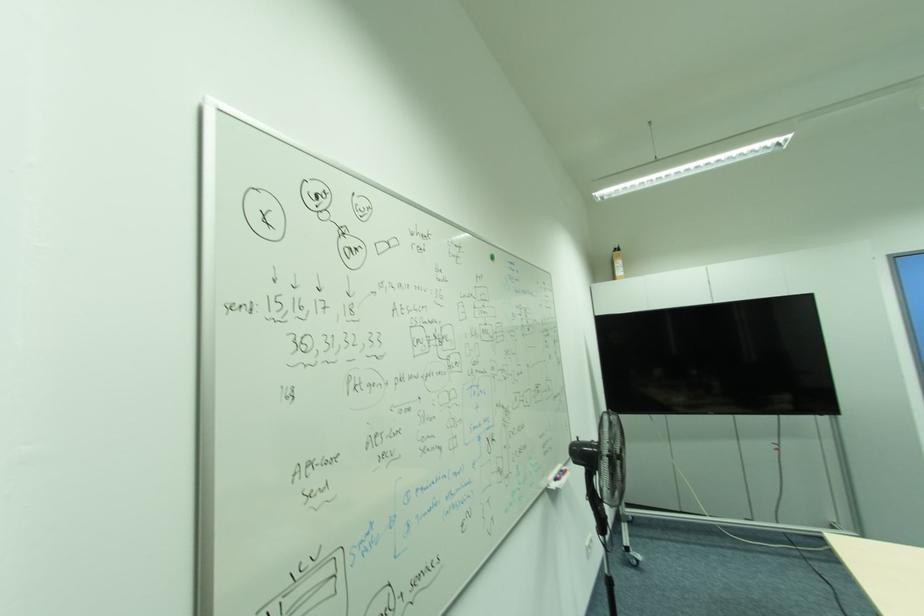
Locate an element on the screen. The height and width of the screenshot is (616, 924). fan stand wheels is located at coordinates (611, 459).